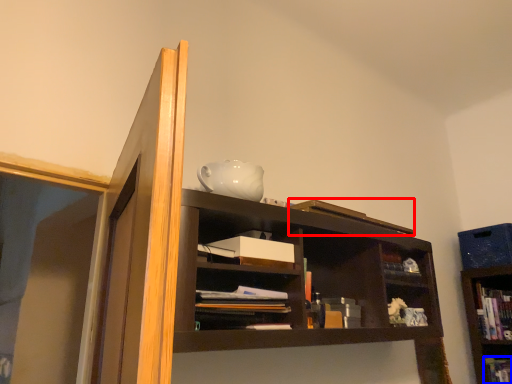
Question: Which of the following is the closest to the observer, book (highlighted by a red box) or book (highlighted by a blue box)?

Choices:
 (A) book
 (B) book

Answer: (A)